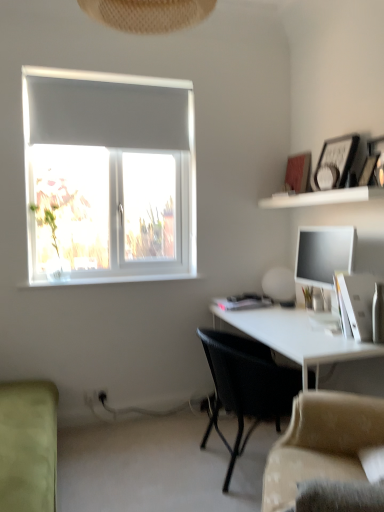
This screenshot has width=384, height=512. In order to click on vacant space situated on the left part of satin black monitor at right in this screenshot , I will do `click(276, 316)`.